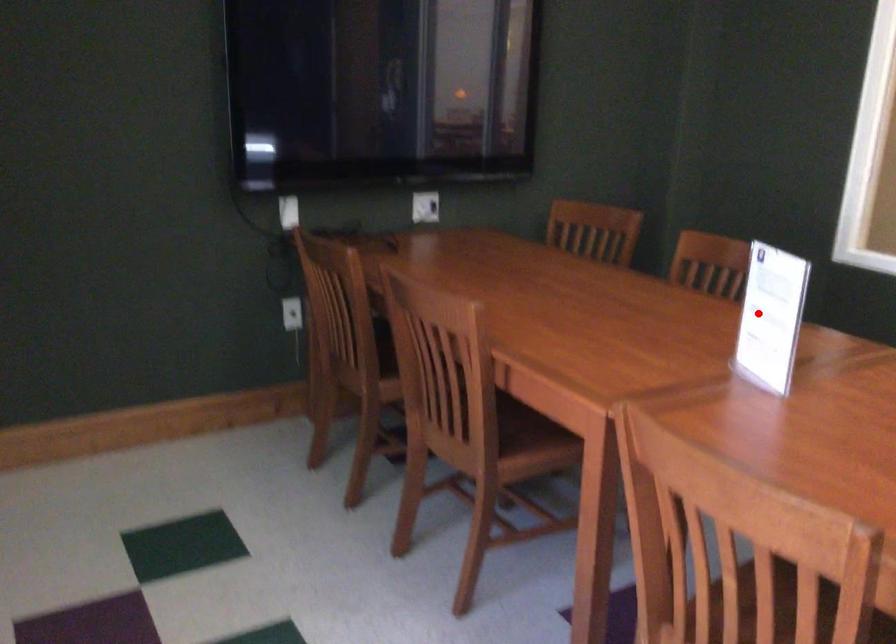
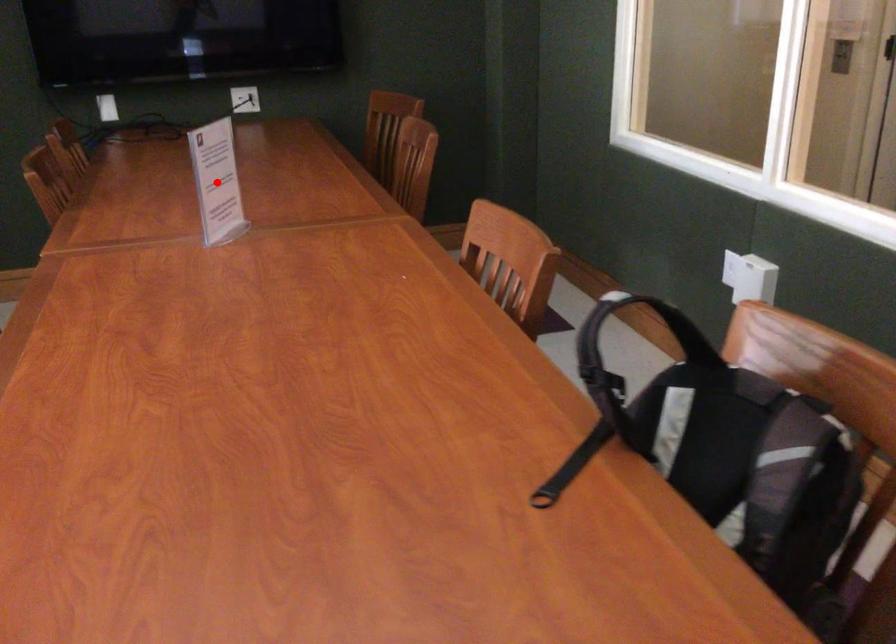
I am providing you with two images of the same scene from different viewpoints. A red point is marked on the first image and another point is marked on the second image. Is the red point in image1 aligned with the point shown in image2?

Yes